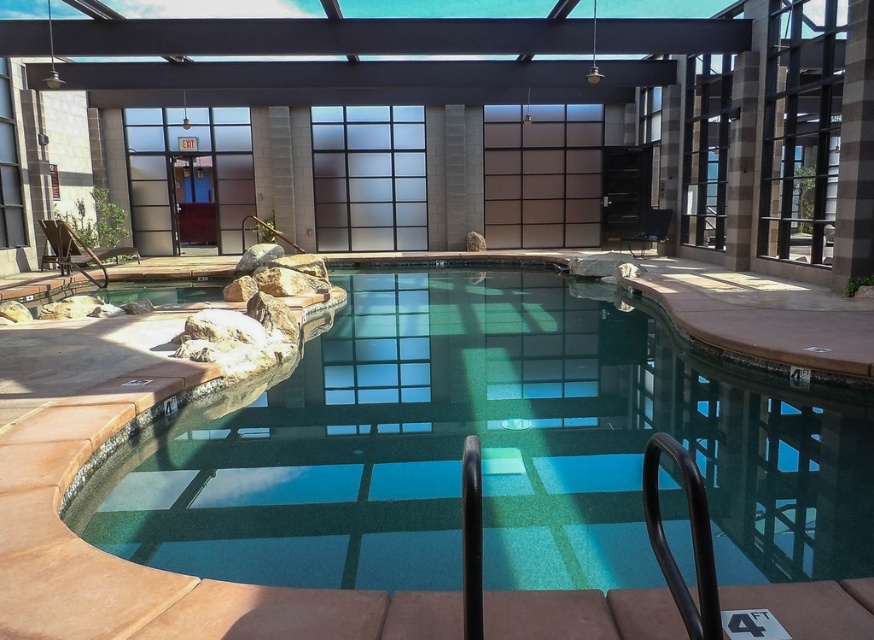
Question: Which of the following is the farthest from the observer?

Choices:
 (A) green tile swimming pool at center
 (B) transparent glass pool at center

Answer: (B)

Question: Can you confirm if transparent glass pool at center is positioned to the right of green tile swimming pool at center?

Choices:
 (A) no
 (B) yes

Answer: (A)

Question: Among these objects, which one is nearest to the camera?

Choices:
 (A) transparent glass pool at center
 (B) green tile swimming pool at center

Answer: (B)

Question: Is transparent glass pool at center wider than green tile swimming pool at center?

Choices:
 (A) yes
 (B) no

Answer: (A)

Question: Does transparent glass pool at center have a lesser width compared to green tile swimming pool at center?

Choices:
 (A) yes
 (B) no

Answer: (B)

Question: Which of the following is the farthest from the observer?

Choices:
 (A) (566, 35)
 (B) (192, 460)

Answer: (A)